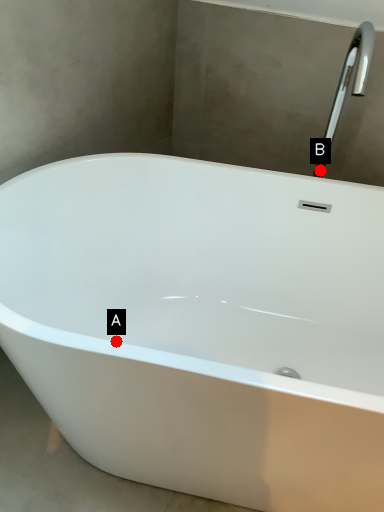
Question: Two points are circled on the image, labeled by A and B beside each circle. Among these points, which one is nearest to the camera?

Choices:
 (A) A is closer
 (B) B is closer

Answer: (A)